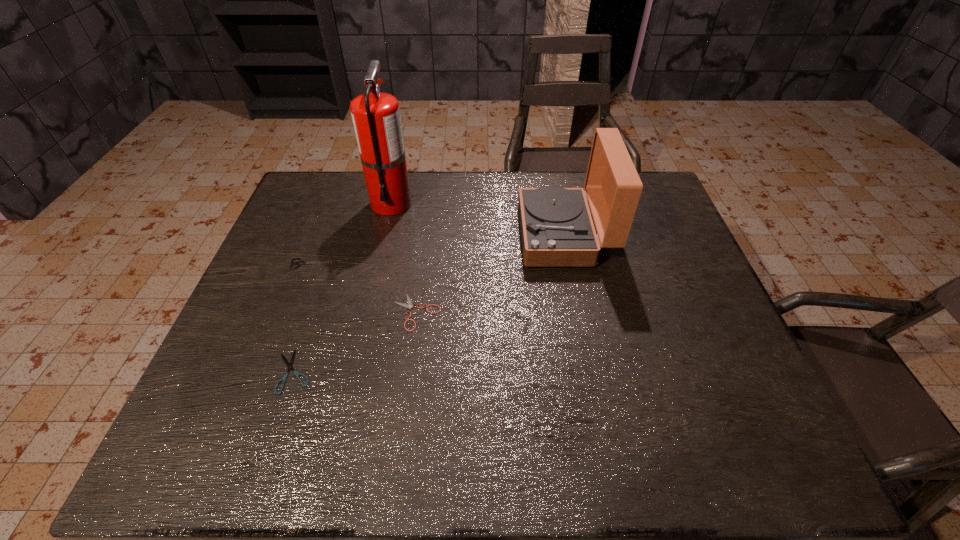
You are a GUI agent. You are given a task and a screenshot of the screen. Output one action in this format:
    pyautogui.click(x=<x>, y=<y>)
    Task: Click on the vacant space that's between the nearest object and the phonograph record
    The width and height of the screenshot is (960, 540).
    Given the screenshot: What is the action you would take?
    pyautogui.click(x=429, y=303)

Select which object appears as the fourth closest to the second farthest shears. Please provide its 2D coordinates. Your answer should be formatted as a tuple, i.e. [(x, y)], where the tuple contains the x and y coordinates of a point satisfying the conditions above.

[(376, 118)]

Locate an element on the screen. The image size is (960, 540). object that is the fourth closest to the second farthest shears is located at coordinates (376, 118).

Locate which shears is the closest to the second nearest object. Please provide its 2D coordinates. Your answer should be formatted as a tuple, i.e. [(x, y)], where the tuple contains the x and y coordinates of a point satisfying the conditions above.

[(296, 373)]

Identify the location of the second closest shears to the tallest object. The image size is (960, 540). (409, 305).

At what (x,y) coordinates should I click in order to perform the action: click on vacant space that satisfies the following two spatial constraints: 1. on the face of the fourth shortest object; 2. on the front side of the nearest object. Please return your answer as a coordinate pair (x, y). Looking at the image, I should click on (591, 372).

You are a GUI agent. You are given a task and a screenshot of the screen. Output one action in this format:
    pyautogui.click(x=<x>, y=<y>)
    Task: Click on the free space in the image that satisfies the following two spatial constraints: 1. on the face of the phonograph record; 2. on the front side of the third tallest object
    The height and width of the screenshot is (540, 960).
    Given the screenshot: What is the action you would take?
    pyautogui.click(x=569, y=264)

The image size is (960, 540). Identify the location of vacant position in the image that satisfies the following two spatial constraints: 1. on the front side of the fourth farthest object; 2. on the right side of the farthest shears. (293, 312).